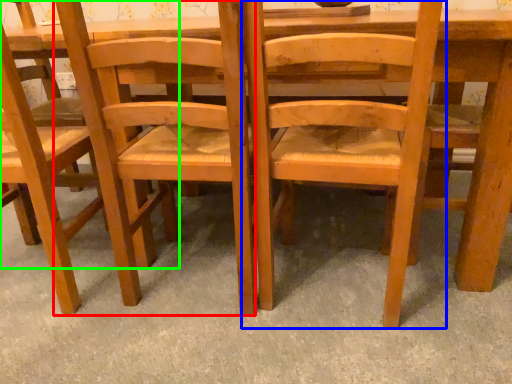
Question: Which object is positioned closest to chair (highlighted by a red box)? Select from chair (highlighted by a blue box) and chair (highlighted by a green box).

Choices:
 (A) chair
 (B) chair

Answer: (A)